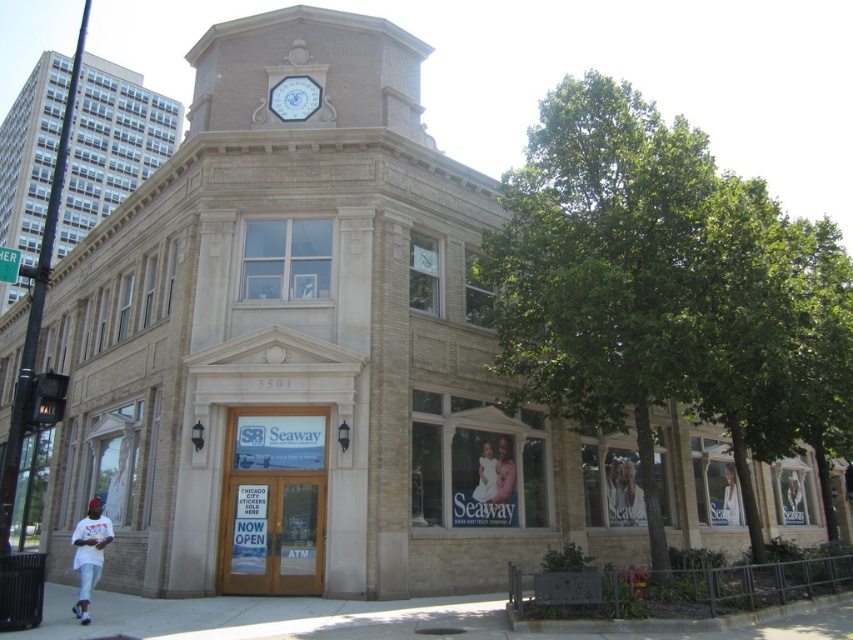
Question: Observing the image, what is the correct spatial positioning of green leafy tree at right in reference to brick building at upper left?

Choices:
 (A) left
 (B) right

Answer: (B)

Question: Which point is farther to the camera?

Choices:
 (A) green leafy tree at right
 (B) brick building at upper left

Answer: (A)

Question: Which point is farther to the camera?

Choices:
 (A) (280, 83)
 (B) (590, 186)

Answer: (A)

Question: Is green leafy tree at right further to camera compared to brick building at upper left?

Choices:
 (A) yes
 (B) no

Answer: (A)

Question: Can you confirm if green leafy tree at right is bigger than white glossy clock at upper center?

Choices:
 (A) yes
 (B) no

Answer: (A)

Question: Which object is positioned closest to the white glossy clock at upper center?

Choices:
 (A) brick building at upper left
 (B) green leafy tree at right

Answer: (B)